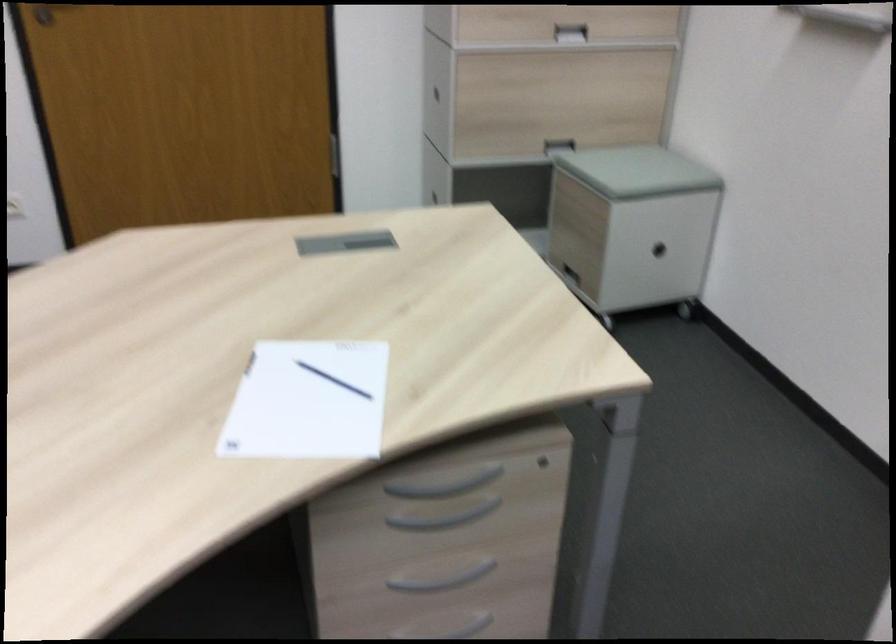
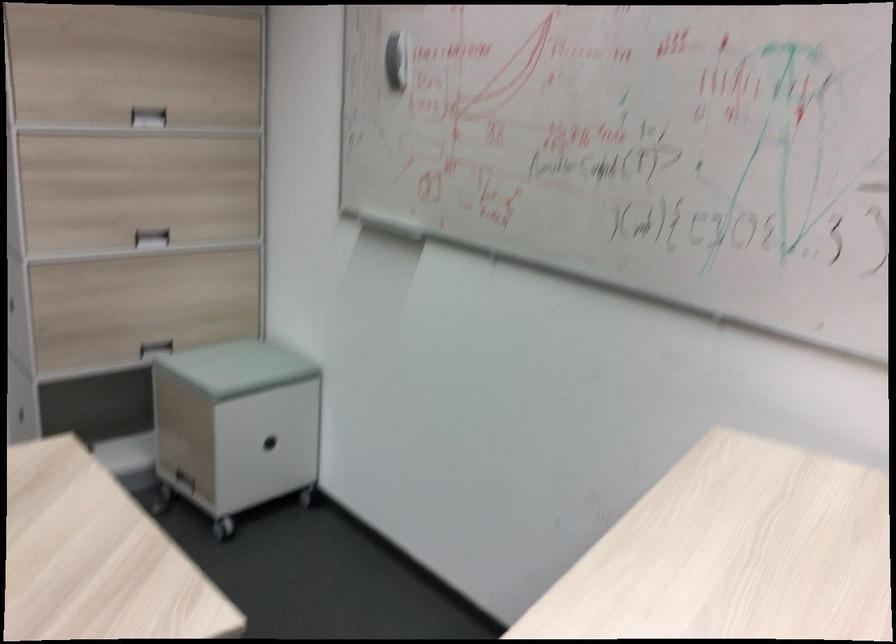
Question: The camera is either moving clockwise (left) or counter-clockwise (right) around the object. The first image is from the beginning of the video and the second image is from the end. Is the camera moving left or right when shooting the video?

Choices:
 (A) Left
 (B) Right

Answer: (A)